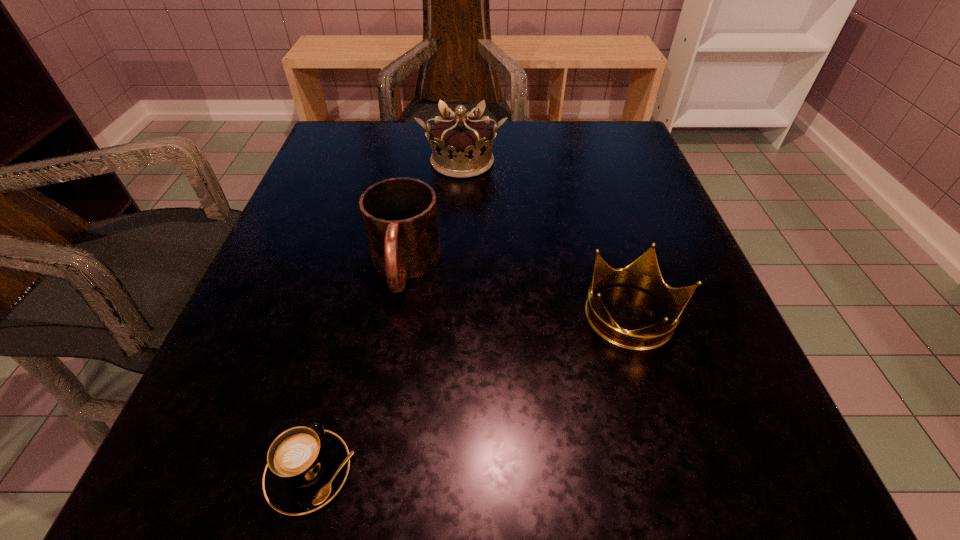
Locate an element on the screen. the farthest object is located at coordinates (461, 145).

Find the location of `the left crown`. the left crown is located at coordinates (461, 145).

This screenshot has height=540, width=960. Find the location of `mug`. mug is located at coordinates (400, 216).

Locate an element on the screen. the rightmost object is located at coordinates (644, 273).

I want to click on the right crown, so click(x=644, y=273).

The image size is (960, 540). Find the location of `the shortest object`. the shortest object is located at coordinates (306, 467).

Find the location of `the nearest object`. the nearest object is located at coordinates (306, 467).

Where is `vacant space located on the front of the farthest object`? vacant space located on the front of the farthest object is located at coordinates (456, 287).

Image resolution: width=960 pixels, height=540 pixels. I want to click on vacant region located 0.240m on the side of the mug with the handle, so click(x=371, y=468).

At what (x,y) coordinates should I click in order to perform the action: click on vacant space situated on the back of the second shortest object. Please return your answer as a coordinate pair (x, y). The image size is (960, 540). Looking at the image, I should click on (600, 212).